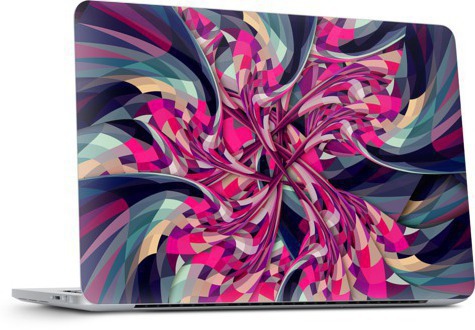
Where is `back of laptop`? The width and height of the screenshot is (475, 330). back of laptop is located at coordinates (119, 309).